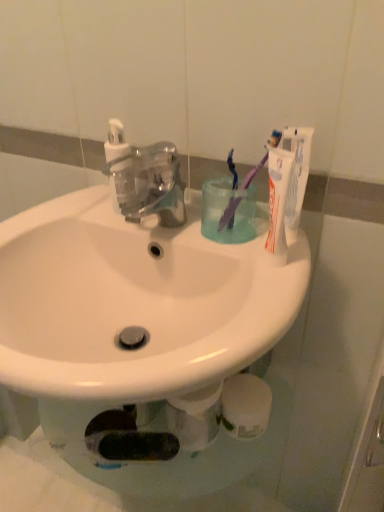
Identify the location of vacant area that is in front of purple plastic toothbrush at upper right, the 1th toothbrush in the right-to-left sequence. (263, 281).